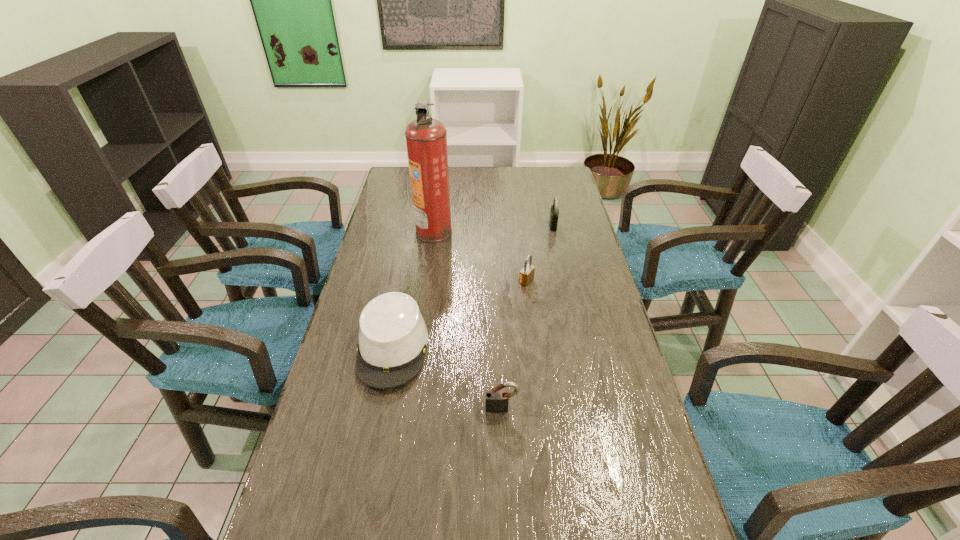
Find the location of a particular element. This screenshot has height=540, width=960. the tallest object is located at coordinates (426, 138).

At what (x,y) coordinates should I click in order to perform the action: click on the farthest padlock. Please return your answer as a coordinate pair (x, y). This screenshot has height=540, width=960. Looking at the image, I should click on (554, 212).

This screenshot has height=540, width=960. Find the location of `the rightmost object`. the rightmost object is located at coordinates (554, 212).

This screenshot has width=960, height=540. In order to click on the fourth object from left to right in this screenshot , I will do `click(527, 273)`.

You are a GUI agent. You are given a task and a screenshot of the screen. Output one action in this format:
    pyautogui.click(x=<x>, y=<y>)
    Task: Click on the second nearest padlock
    Image resolution: width=960 pixels, height=540 pixels.
    Given the screenshot: What is the action you would take?
    pyautogui.click(x=527, y=273)

You are a GUI agent. You are given a task and a screenshot of the screen. Output one action in this format:
    pyautogui.click(x=<x>, y=<y>)
    Task: Click on the nearest object
    The width and height of the screenshot is (960, 540).
    Given the screenshot: What is the action you would take?
    pyautogui.click(x=497, y=401)

At what (x,y) coordinates should I click in order to perform the action: click on the leftmost padlock. Please return your answer as a coordinate pair (x, y). Looking at the image, I should click on (497, 401).

Identify the location of the second nearest object. (393, 337).

Locate an element on the screen. This screenshot has height=540, width=960. vacant space located at the nozzle of the fire extinguisher is located at coordinates (504, 232).

What are the coordinates of `free spot located 0.290m on the front of the rightmost object` in the screenshot? It's located at (565, 284).